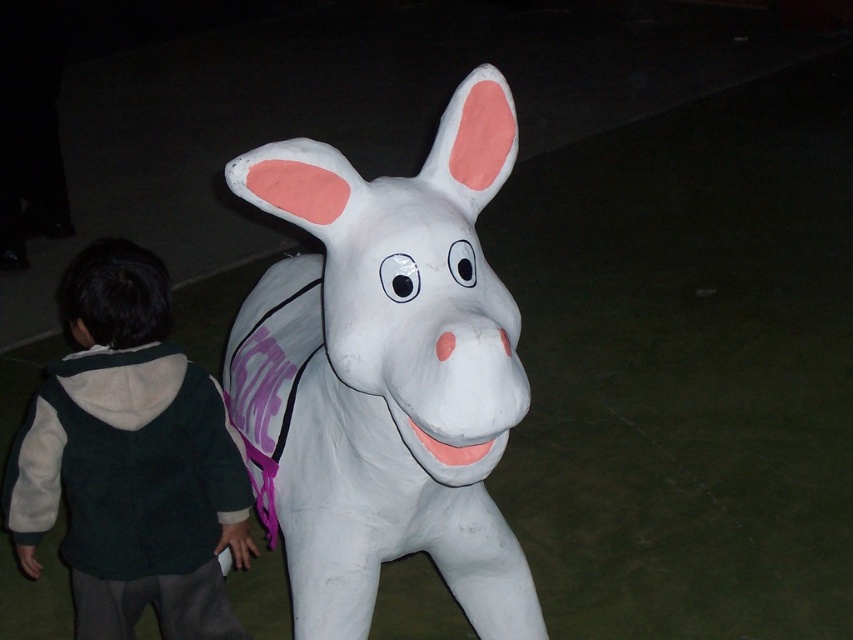
You are a parent trying to take a photo of your child with the white matte donkey at center and the dark green fleece jacket at lower left. To ensure both the child and the donkey are in the frame, which object should you position closer to the camera?

The dark green fleece jacket at lower left should be positioned closer to the camera because the white matte donkey at center is taller than the dark green fleece jacket at lower left, so bringing the jacket forward will help both objects be in the frame.

You are a photographer trying to capture a photo of the white matte donkey at center without the dark green fleece jacket at lower left blocking the view. Based on their sizes, can you fit the entire donkey statue into the frame while keeping the jacket out?

The white matte donkey at center is wider than the dark green fleece jacket at lower left, so you can position the camera to focus on the donkey while moving sideways to exclude the jacket from the frame since the donkey is wider and requires more space.

You are a photographer trying to capture a clear photo of the white matte donkey at center without any obstructions. Since the dark green fleece jacket at lower left is in the way, can you move the jacket to the side to get a better shot?

The white matte donkey at center is positioned over dark green fleece jacket at lower left, meaning the jacket is directly in front of the donkey. Moving the jacket to the side would allow an unobstructed view of the donkey for the photo.